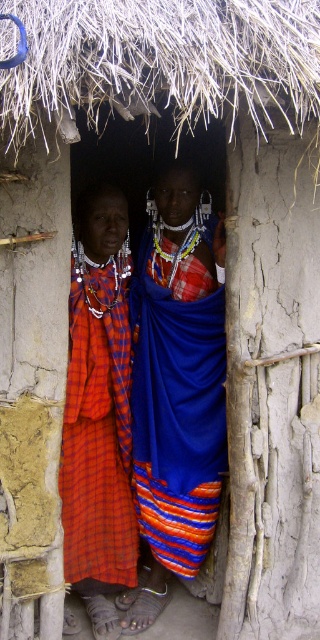
Does blue woven cloth at center appear over plaid fabric skirt at left?

Yes.

Is blue woven cloth at center smaller than plaid fabric skirt at left?

No, blue woven cloth at center is not smaller than plaid fabric skirt at left.

In order to click on blue woven cloth at center in this screenshot , I will do `click(176, 394)`.